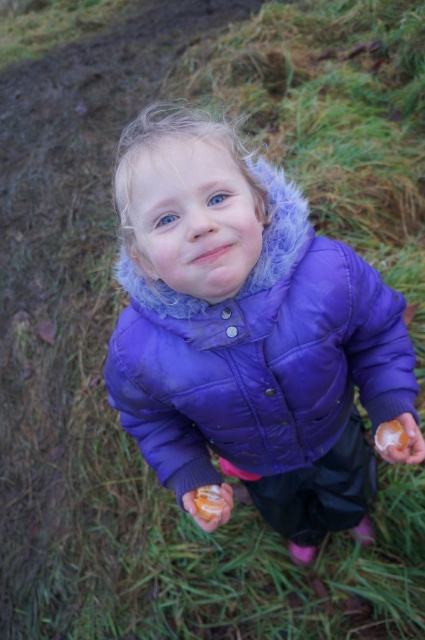
Question: Is matte orange donut at center positioned at the back of orange matte donut at center?

Choices:
 (A) yes
 (B) no

Answer: (A)

Question: Among these objects, which one is nearest to the camera?

Choices:
 (A) orange matte donut at center
 (B) matte orange donut at center
 (C) purple puffy jacket at center

Answer: (C)

Question: Is purple puffy jacket at center wider than orange matte donut at center?

Choices:
 (A) yes
 (B) no

Answer: (A)

Question: Which object is positioned closest to the purple puffy jacket at center?

Choices:
 (A) orange matte donut at center
 (B) matte orange donut at center

Answer: (B)

Question: Which point is closer to the camera?

Choices:
 (A) purple puffy jacket at center
 (B) orange matte donut at center
 (C) matte orange donut at center

Answer: (A)

Question: Can you confirm if purple puffy jacket at center is positioned to the right of matte orange donut at center?

Choices:
 (A) yes
 (B) no

Answer: (A)